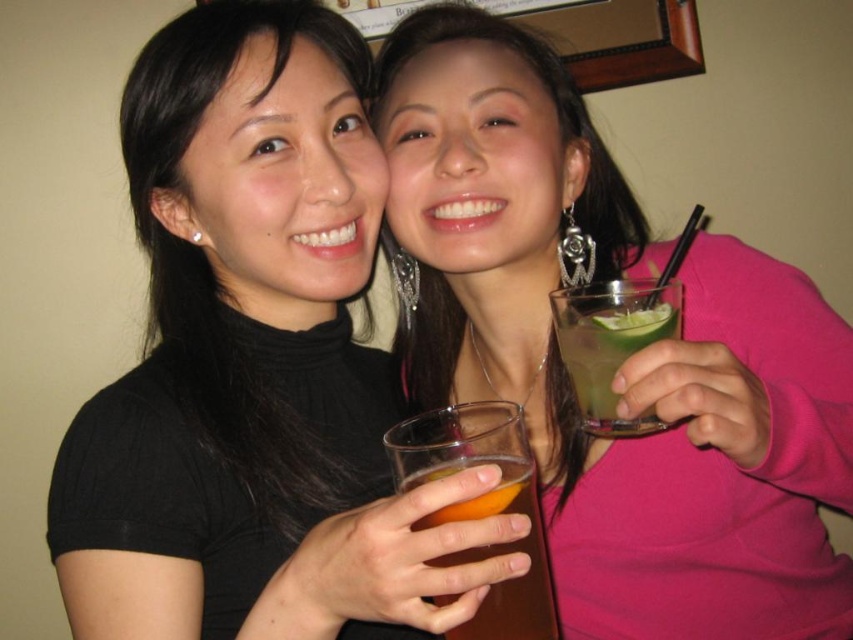
Who is higher up, matte black top at center or green translucent glass at upper right?

matte black top at center is above.

Does matte black top at center appear on the left side of green translucent glass at upper right?

No, matte black top at center is not to the left of green translucent glass at upper right.

I want to click on matte black top at center, so click(x=624, y=364).

The height and width of the screenshot is (640, 853). What are the coordinates of `matte black top at center` in the screenshot? It's located at (624, 364).

Who is shorter, matte black turtleneck at upper left or translucent glass at center?

translucent glass at center is shorter.

Is matte black turtleneck at upper left in front of translucent glass at center?

Yes, matte black turtleneck at upper left is in front of translucent glass at center.

Does point (115, 449) come in front of point (538, 531)?

No, (115, 449) is further to viewer.

Locate an element on the screen. Image resolution: width=853 pixels, height=640 pixels. matte black turtleneck at upper left is located at coordinates (254, 364).

Between matte black turtleneck at upper left and green translucent glass at upper right, which one appears on the right side from the viewer's perspective?

green translucent glass at upper right

Between point (241, 172) and point (614, 340), which one is positioned in front?

Point (614, 340) is in front.

Identify the location of matte black turtleneck at upper left. (254, 364).

I want to click on matte black turtleneck at upper left, so click(254, 364).